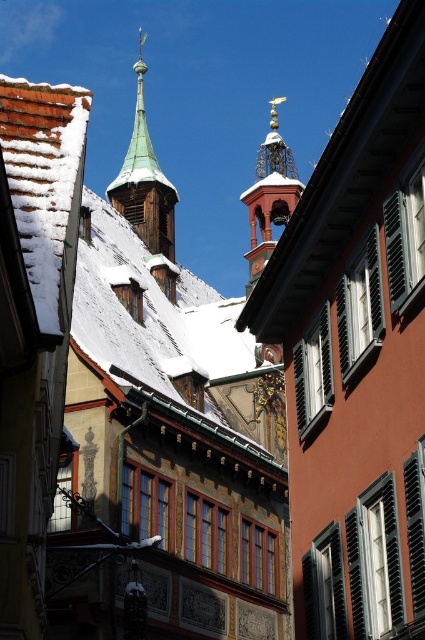
Question: Does snow-covered wooden roof at center appear on the right side of smooth red tile roof at upper center?

Choices:
 (A) yes
 (B) no

Answer: (B)

Question: Does smooth red tile roof at upper center appear over polished brass bell tower at center?

Choices:
 (A) yes
 (B) no

Answer: (B)

Question: Which of the following is the farthest from the observer?

Choices:
 (A) green copper spire at upper left
 (B) polished brass bell tower at center

Answer: (B)

Question: Which is farther from the polished brass bell tower at center?

Choices:
 (A) snow-covered wooden roof at center
 (B) smooth red tile roof at upper center

Answer: (B)

Question: Considering the relative positions of snow-covered wooden roof at center and green copper spire at upper left in the image provided, where is snow-covered wooden roof at center located with respect to green copper spire at upper left?

Choices:
 (A) above
 (B) below

Answer: (B)

Question: Which of these objects is positioned farthest from the polished brass bell tower at center?

Choices:
 (A) smooth red tile roof at upper center
 (B) green copper spire at upper left

Answer: (A)